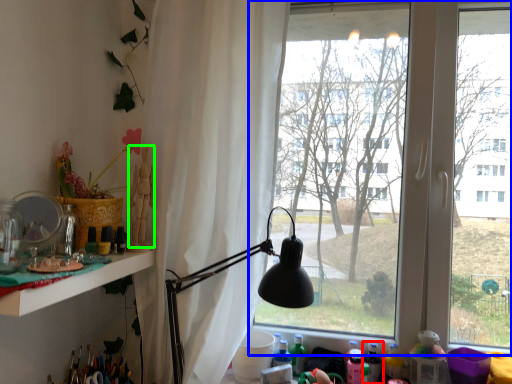
Question: Which is nearer to the bottle (highlighted by a red box)? window (highlighted by a blue box) or person (highlighted by a green box).

Choices:
 (A) window
 (B) person

Answer: (A)